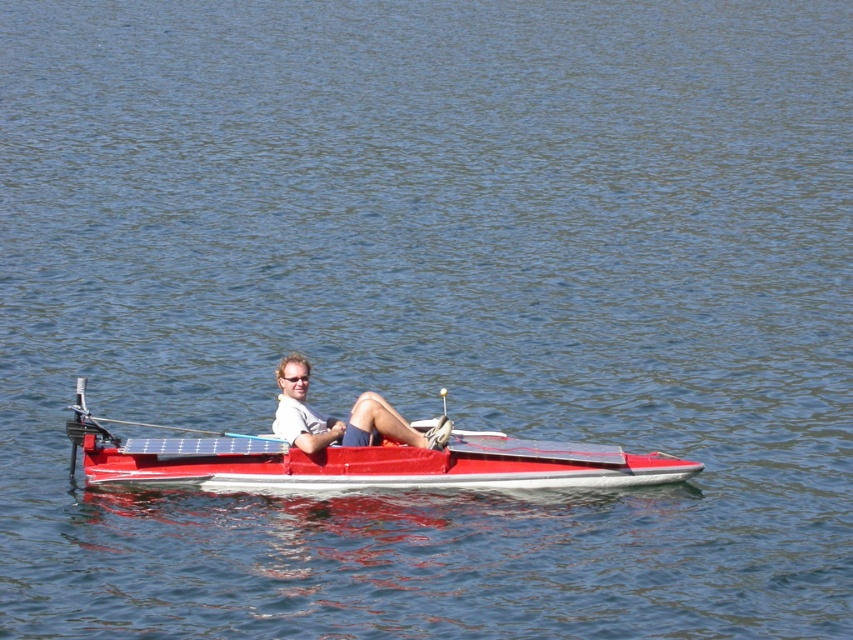
Question: Does metallic red boat at center appear on the right side of blue plastic paddle at center?

Choices:
 (A) no
 (B) yes

Answer: (B)

Question: Which of these objects is positioned closest to the white matte shirt at center?

Choices:
 (A) blue plastic paddle at center
 (B) metallic red boat at center

Answer: (B)

Question: From the image, what is the correct spatial relationship of metallic red boat at center in relation to blue plastic paddle at center?

Choices:
 (A) above
 (B) below

Answer: (B)

Question: Which is nearer to the blue plastic paddle at center?

Choices:
 (A) white matte shirt at center
 (B) metallic red boat at center

Answer: (A)

Question: Which of these objects is positioned closest to the blue plastic paddle at center?

Choices:
 (A) metallic red boat at center
 (B) white matte shirt at center

Answer: (B)

Question: Can you confirm if metallic red boat at center is thinner than white matte shirt at center?

Choices:
 (A) no
 (B) yes

Answer: (A)